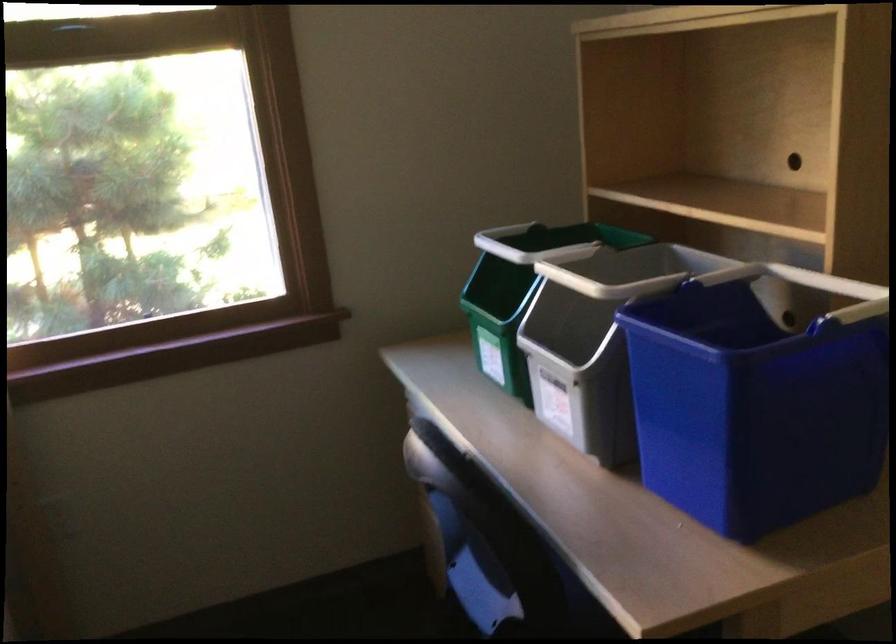
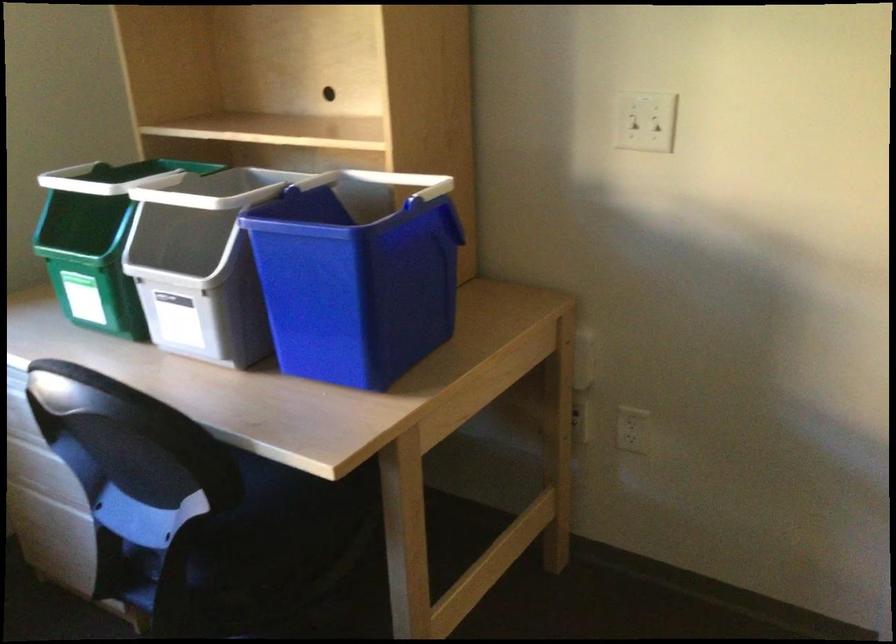
Find the pixel in the second image that matches (x=662, y=261) in the first image.

(245, 185)